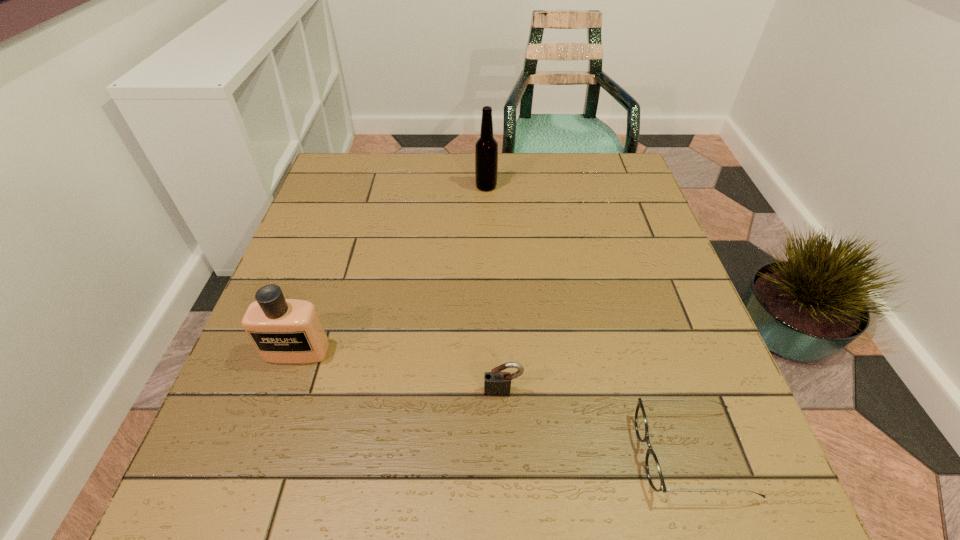
What are the coordinates of `vacant space at the near edge of the desktop` in the screenshot? It's located at pos(324,462).

You are a GUI agent. You are given a task and a screenshot of the screen. Output one action in this format:
    pyautogui.click(x=<x>, y=<y>)
    Task: Click on the blank area at the left edge
    
    Given the screenshot: What is the action you would take?
    pyautogui.click(x=241, y=437)

You are a GUI agent. You are given a task and a screenshot of the screen. Output one action in this format:
    pyautogui.click(x=<x>, y=<y>)
    Task: Click on the vacant space at the right edge
    
    Given the screenshot: What is the action you would take?
    pyautogui.click(x=716, y=451)

Find the location of a particular element. The height and width of the screenshot is (540, 960). free space at the far left corner of the desktop is located at coordinates (359, 186).

This screenshot has height=540, width=960. I want to click on blank space at the near right corner, so click(727, 513).

In order to click on vacant region between the tallest object and the padlock in this screenshot , I will do 494,288.

Find the location of a particular element. vacant space in between the rightmost object and the tallest object is located at coordinates point(588,320).

Where is `vacant area between the farthest object and the third shortest object`? The image size is (960, 540). vacant area between the farthest object and the third shortest object is located at coordinates (392, 268).

You are a GUI agent. You are given a task and a screenshot of the screen. Output one action in this format:
    pyautogui.click(x=<x>, y=<y>)
    Task: Click on the free spot between the padlock and the third nearest object
    Image resolution: width=960 pixels, height=540 pixels.
    Given the screenshot: What is the action you would take?
    pyautogui.click(x=399, y=370)

At what (x,y) coordinates should I click in order to perform the action: click on vacant area between the perfume and the nearest object. Please return your answer as a coordinate pair (x, y). Looking at the image, I should click on (493, 402).